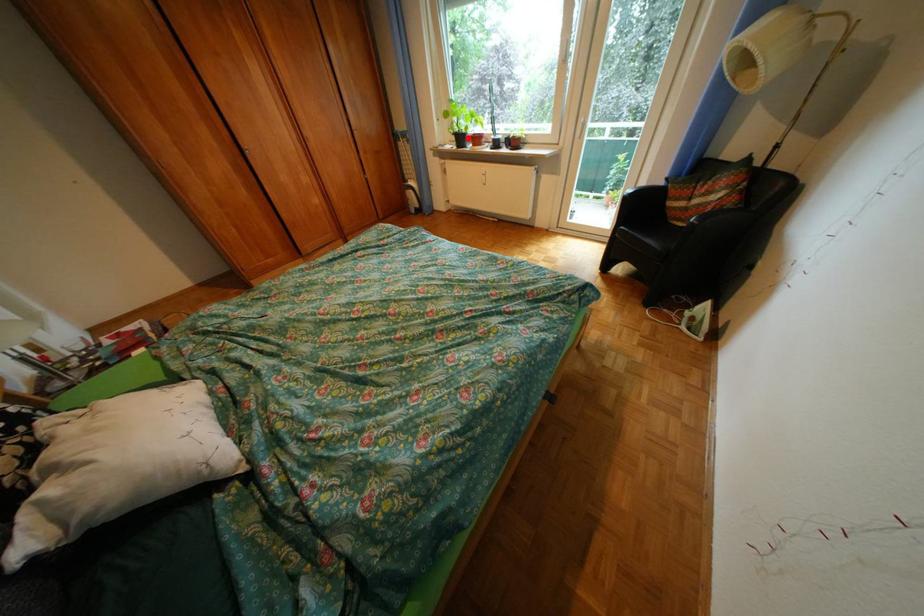
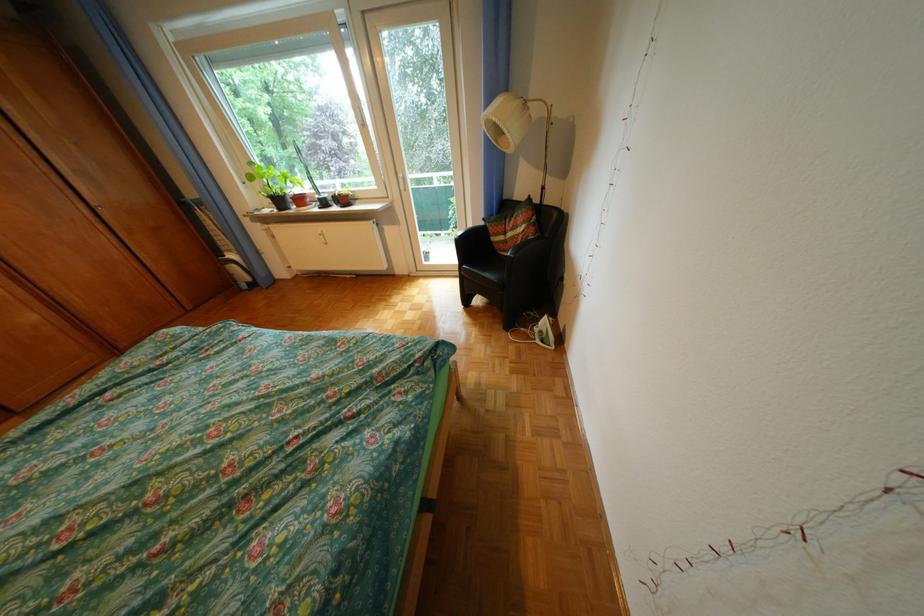
Where in the second image is the point corresponding to the highlighted location from the first image?

(284, 201)